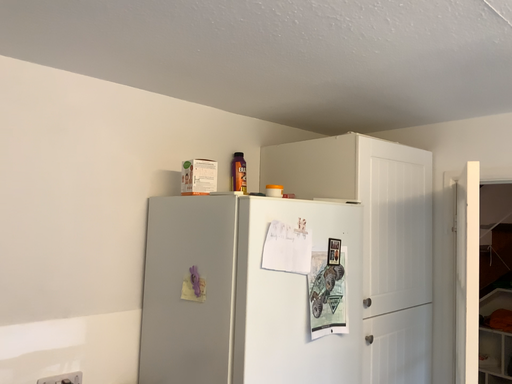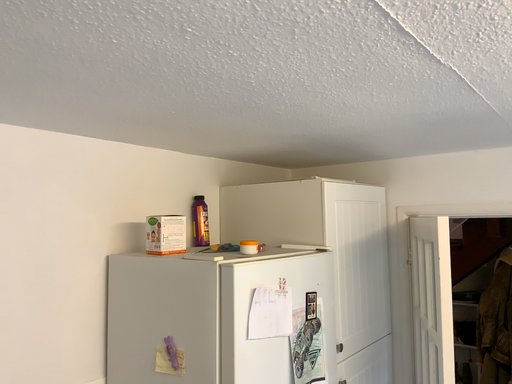
Question: How did the camera likely rotate when shooting the video?

Choices:
 (A) rotated left
 (B) rotated right

Answer: (B)